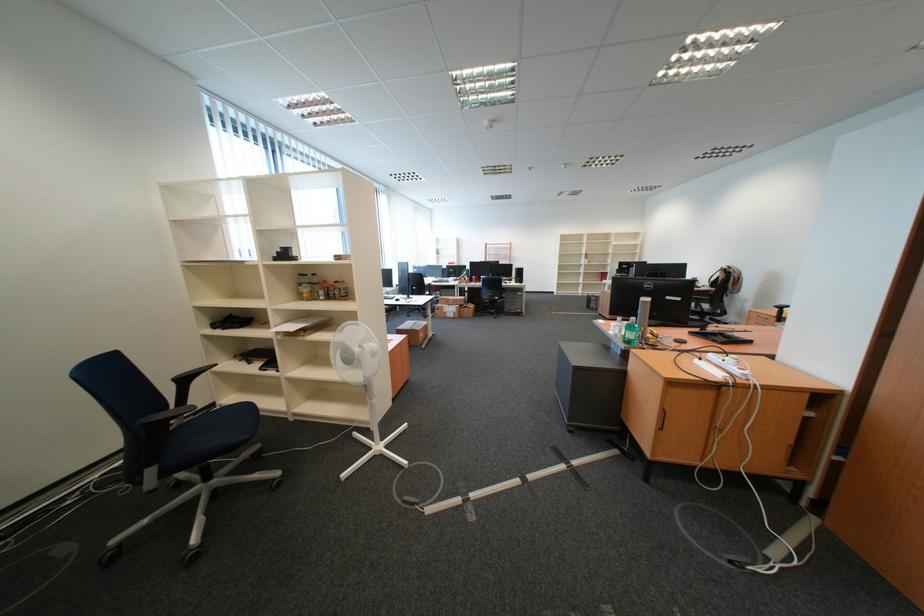
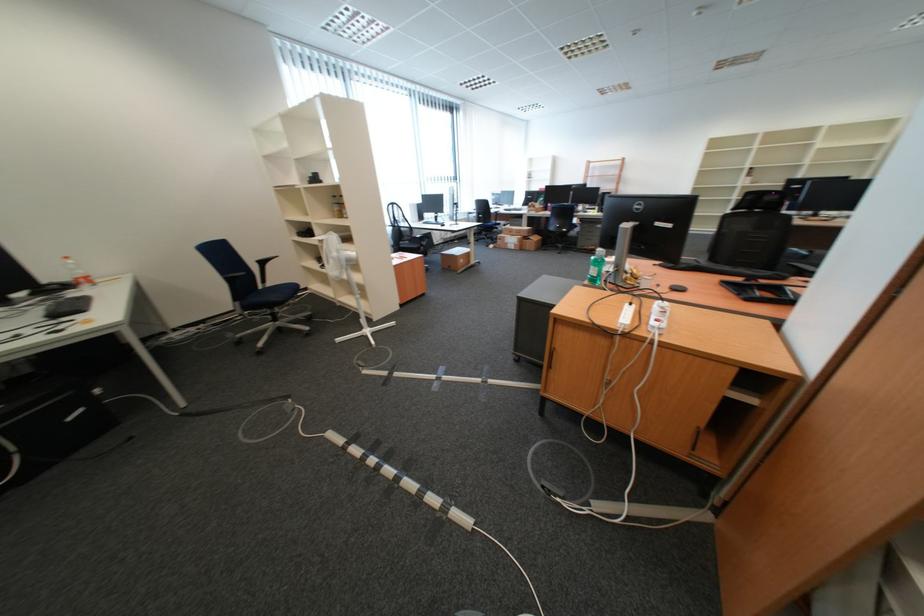
The point at (531, 317) is marked in the first image. Where is the corresponding point in the second image?

(604, 254)